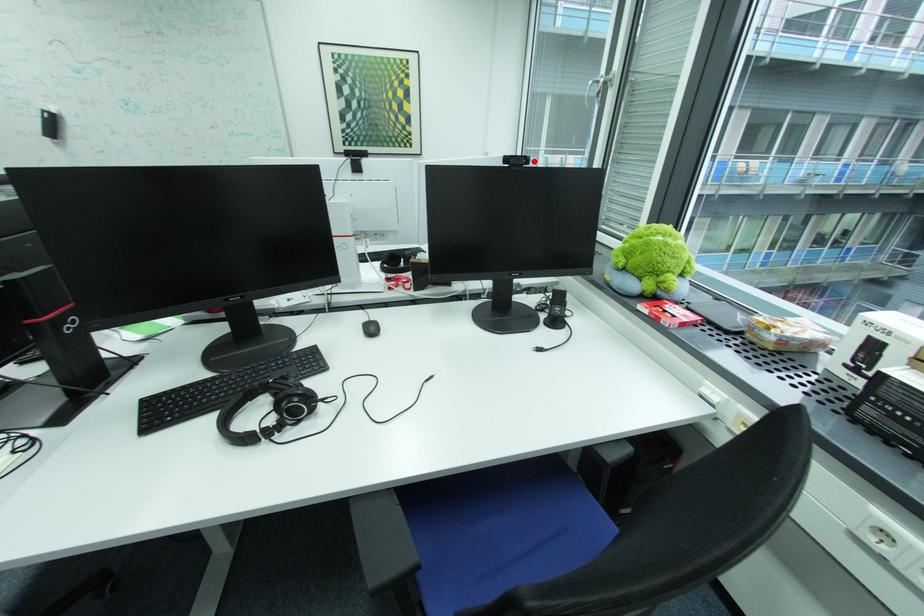
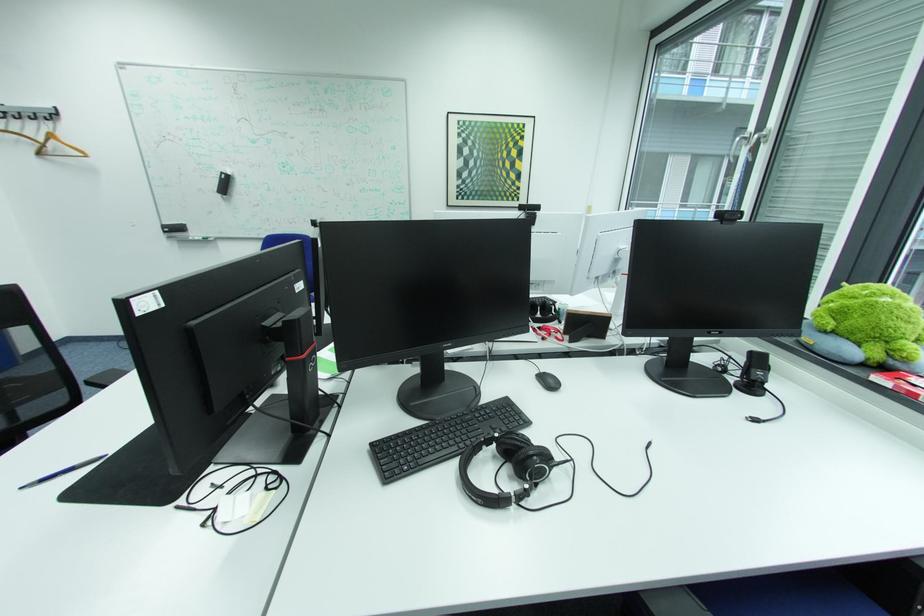
In the second image, find the point that corresponds to the highlighted location in the first image.

(748, 217)